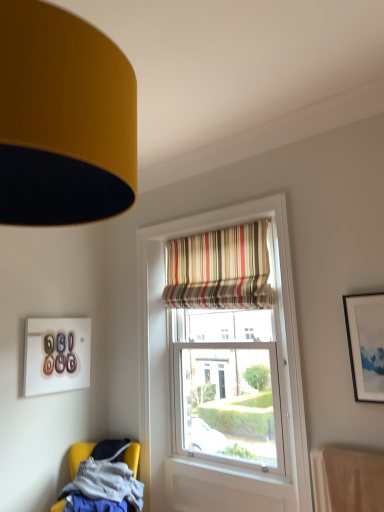
Question: Is matte white picture frame at upper right, positioned as the first picture frame in front-to-back order, not near striped fabric curtain at upper center?

Choices:
 (A) no
 (B) yes

Answer: (A)

Question: From the image's perspective, is matte white picture frame at upper right, the second picture frame when ordered from back to front, below striped fabric curtain at upper center?

Choices:
 (A) no
 (B) yes

Answer: (B)

Question: Can you confirm if matte white picture frame at upper right, positioned as the 2th picture frame in left-to-right order, is positioned to the right of striped fabric curtain at upper center?

Choices:
 (A) yes
 (B) no

Answer: (A)

Question: Is striped fabric curtain at upper center a part of matte white picture frame at upper right, positioned as the first picture frame in front-to-back order?

Choices:
 (A) yes
 (B) no

Answer: (B)

Question: From the image's perspective, is matte white picture frame at upper right, positioned as the first picture frame in front-to-back order, over striped fabric curtain at upper center?

Choices:
 (A) no
 (B) yes

Answer: (A)

Question: Is yellow fabric chair at lower left spatially inside striped fabric curtain at upper center, or outside of it?

Choices:
 (A) inside
 (B) outside

Answer: (B)

Question: From a real-world perspective, relative to striped fabric curtain at upper center, is yellow fabric chair at lower left vertically above or below?

Choices:
 (A) above
 (B) below

Answer: (B)

Question: Is yellow fabric chair at lower left taller or shorter than striped fabric curtain at upper center?

Choices:
 (A) tall
 (B) short

Answer: (B)

Question: From the image's perspective, is yellow fabric chair at lower left located above or below striped fabric curtain at upper center?

Choices:
 (A) above
 (B) below

Answer: (B)

Question: Do you think matte white picture frame at upper right, the second picture frame when ordered from back to front, is within matte glass picture frame at upper left, the 2th picture frame viewed from the right, or outside of it?

Choices:
 (A) inside
 (B) outside

Answer: (B)

Question: From the image's perspective, is matte white picture frame at upper right, which is the 1th picture frame in right-to-left order, positioned above or below matte glass picture frame at upper left, the second picture frame in the front-to-back sequence?

Choices:
 (A) above
 (B) below

Answer: (A)

Question: Does point (364, 322) appear closer or farther from the camera than point (31, 331)?

Choices:
 (A) closer
 (B) farther

Answer: (A)

Question: Considering their positions, is matte white picture frame at upper right, the second picture frame when ordered from back to front, located in front of or behind matte glass picture frame at upper left, the second picture frame in the front-to-back sequence?

Choices:
 (A) behind
 (B) front

Answer: (B)

Question: From the image's perspective, is matte glass picture frame at upper left, placed as the 1th picture frame when sorted from back to front, located above or below striped fabric curtain at upper center?

Choices:
 (A) below
 (B) above

Answer: (A)

Question: Based on their positions, is matte glass picture frame at upper left, placed as the 1th picture frame when sorted from back to front, located to the left or right of striped fabric curtain at upper center?

Choices:
 (A) left
 (B) right

Answer: (A)